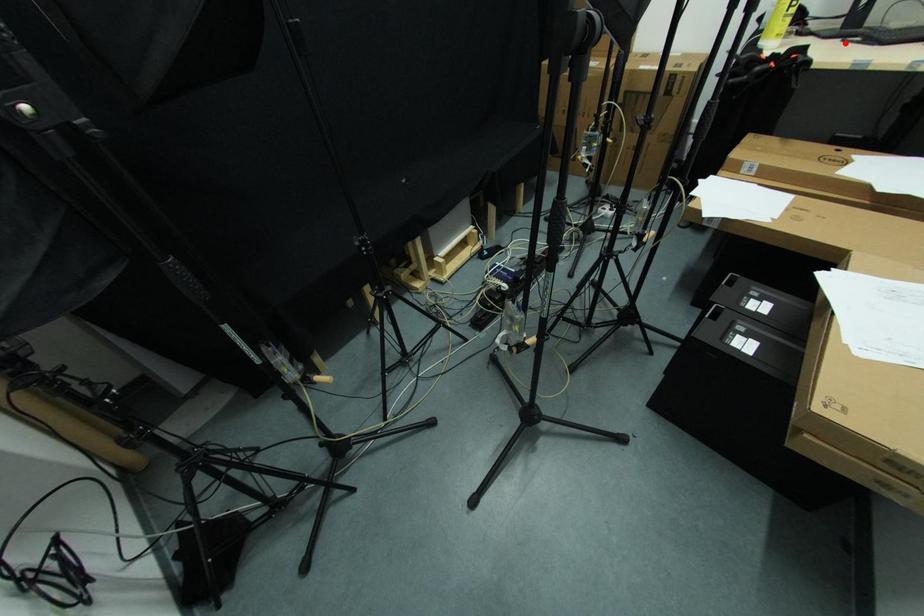
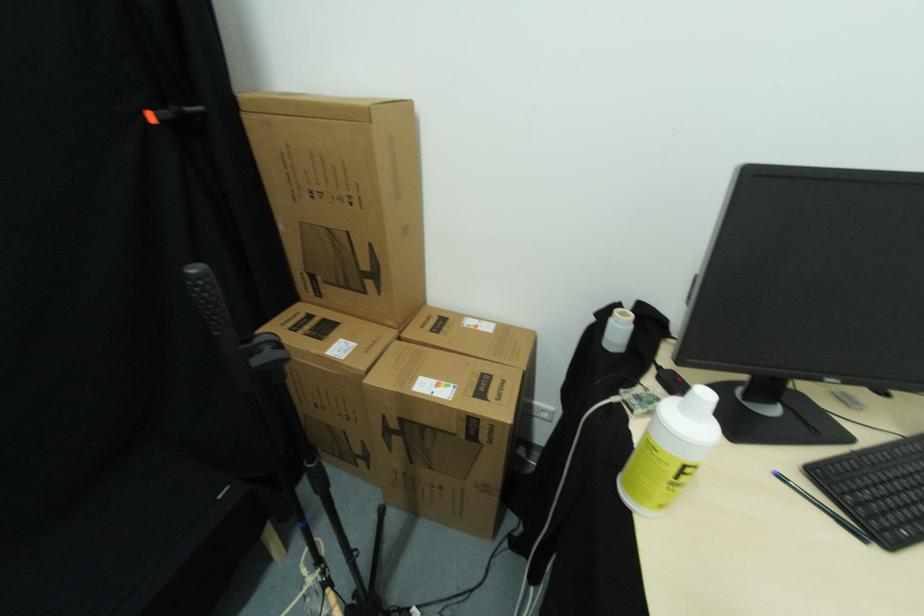
In the second image, find the point that corresponds to the highlighted location in the first image.

(784, 479)